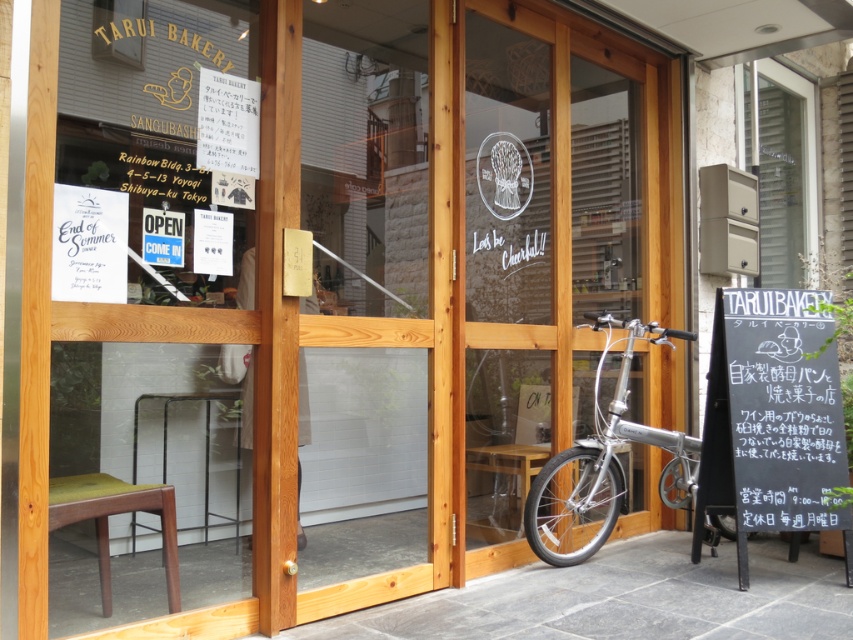
Between point (209, 442) and point (758, 198), which one is positioned in front?

Positioned in front is point (209, 442).

Does wooden chair at lower left have a lesser width compared to clear glass mailbox at upper right?

Indeed, wooden chair at lower left has a lesser width compared to clear glass mailbox at upper right.

Which is behind, point (74, 192) or point (781, 248)?

Positioned behind is point (781, 248).

The image size is (853, 640). I want to click on wooden chair at lower left, so click(x=129, y=301).

Based on the photo, is transparent glass door at center smaller than silver metallic bicycle at center?

No.

Is transparent glass door at center behind silver metallic bicycle at center?

No.

Which is in front, point (651, 500) or point (689, 484)?

Point (689, 484) is more forward.

Locate an element on the screen. The height and width of the screenshot is (640, 853). transparent glass door at center is located at coordinates (540, 248).

Can you confirm if transparent glass door at center is bigger than black chalkboard at right?

Indeed, transparent glass door at center has a larger size compared to black chalkboard at right.

Identify the location of transparent glass door at center. The height and width of the screenshot is (640, 853). (540, 248).